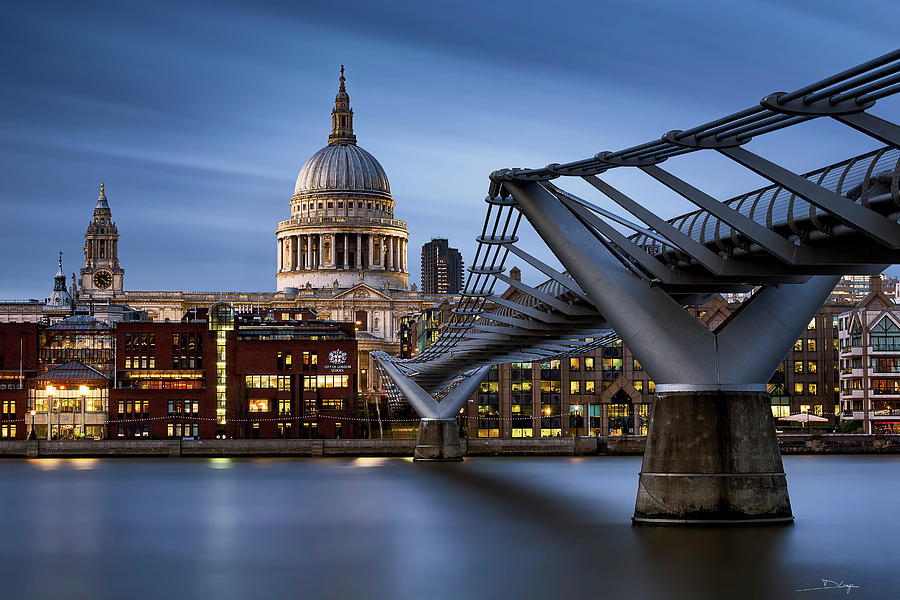
Image resolution: width=900 pixels, height=600 pixels. Find the location of `bright lights`. bright lights is located at coordinates (84, 392), (50, 390).